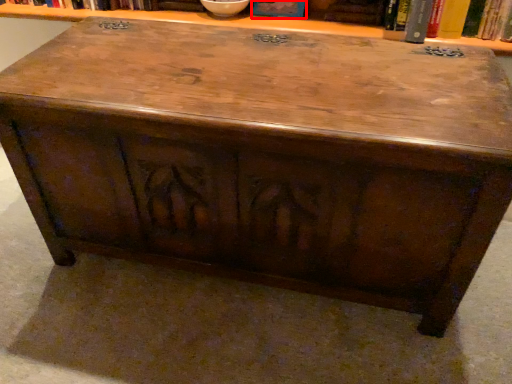
Question: From the image's perspective, what is the correct spatial positioning of book (annotated by the red box) in reference to book?

Choices:
 (A) below
 (B) above

Answer: (B)